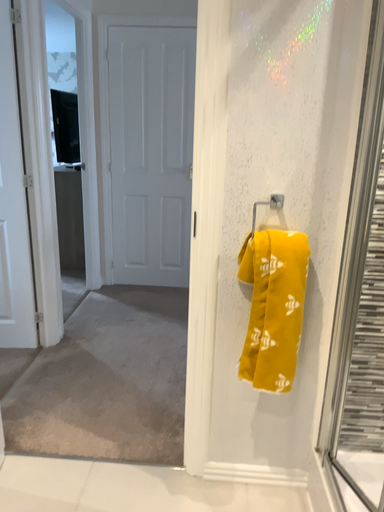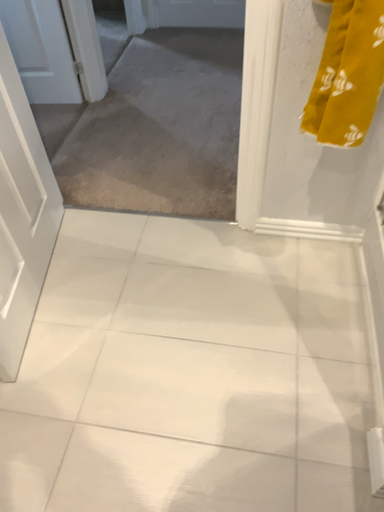
Question: Which way did the camera rotate in the video?

Choices:
 (A) rotated left
 (B) rotated right

Answer: (A)